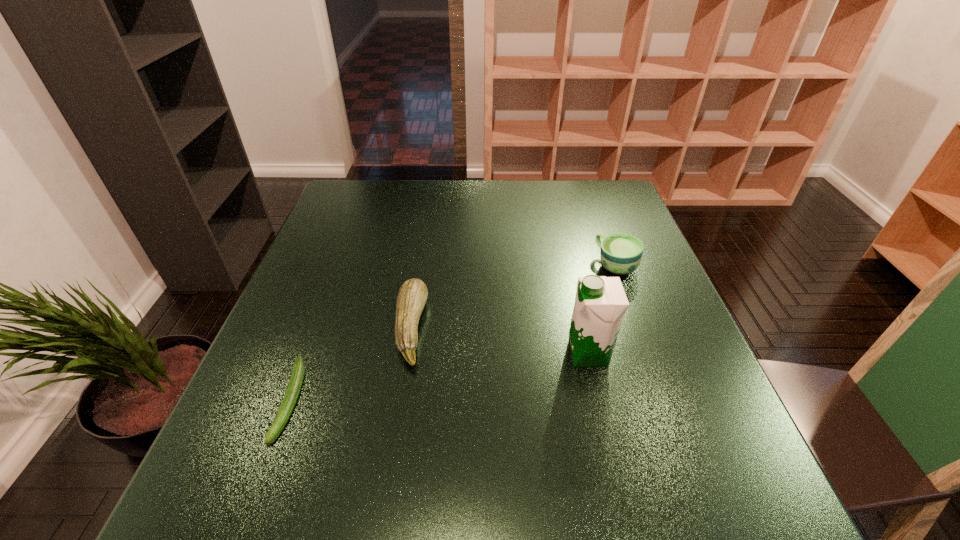
This screenshot has width=960, height=540. I want to click on object that stands as the second closest to the soya milk, so click(x=412, y=296).

Select which object appears as the closest to the taller zucchini. Please provide its 2D coordinates. Your answer should be formatted as a tuple, i.e. [(x, y)], where the tuple contains the x and y coordinates of a point satisfying the conditions above.

[(294, 386)]

This screenshot has height=540, width=960. In order to click on vacant space that satisfies the following two spatial constraints: 1. at the stem end of the third tallest object; 2. on the front-facing side of the leftmost object in this screenshot , I will do `click(399, 401)`.

Image resolution: width=960 pixels, height=540 pixels. In order to click on free space in the image that satisfies the following two spatial constraints: 1. on the front-facing side of the third object from left to right; 2. on the front-facing side of the left zucchini in this screenshot , I will do `click(599, 401)`.

This screenshot has height=540, width=960. What are the coordinates of `vacant space that satisfies the following two spatial constraints: 1. at the stem end of the third object from right to left; 2. on the front-facing side of the left zucchini` in the screenshot? It's located at (399, 401).